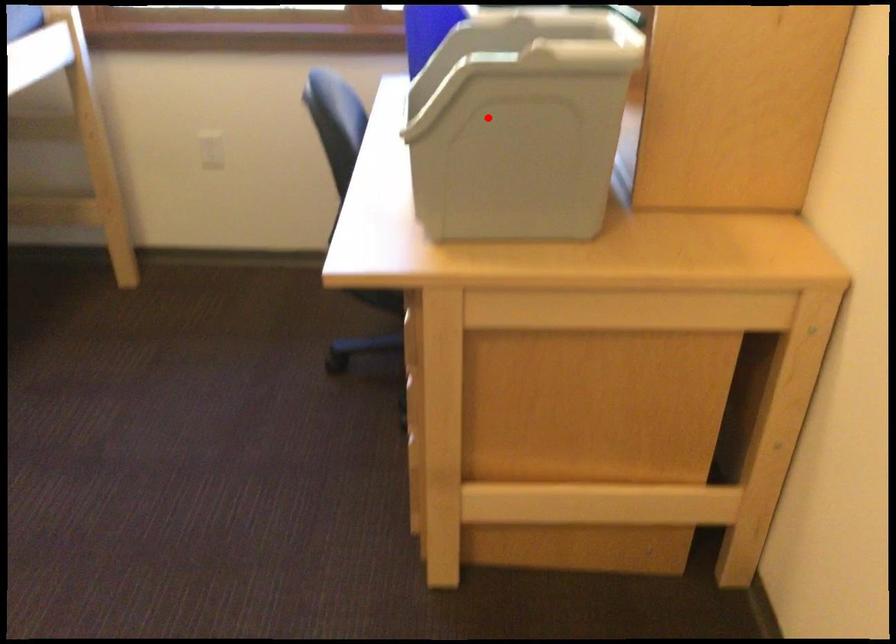
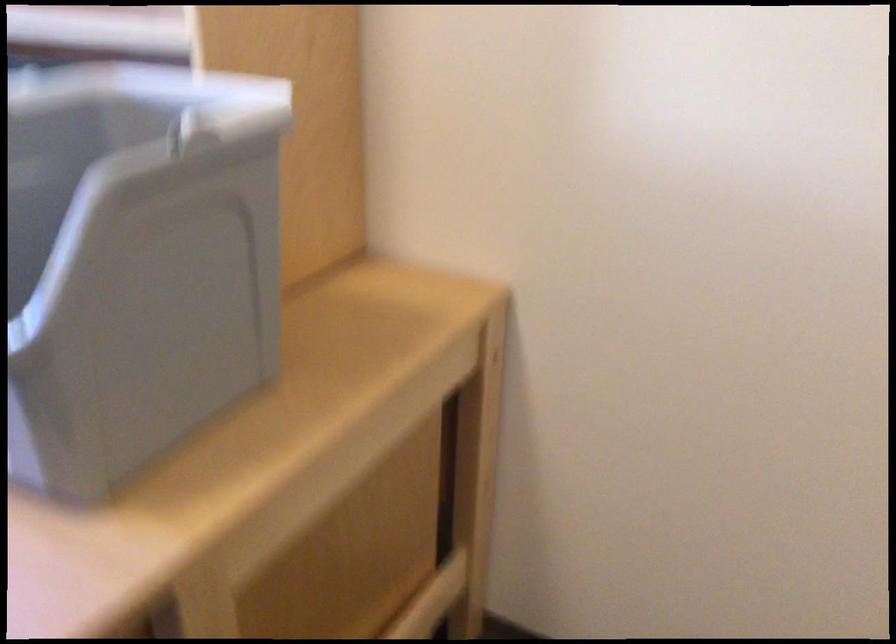
Question: A red point is marked in image1. In image2, is the corresponding 3D point closer to the camera or farther? Reply with the corresponding letter.

Choices:
 (A) The corresponding 3D point is closer.
 (B) The corresponding 3D point is farther.

Answer: (A)